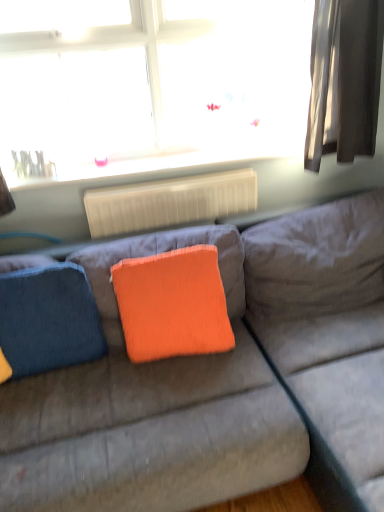
Question: Should I look upward or downward to see white plastic radiator at center?

Choices:
 (A) up
 (B) down

Answer: (A)

Question: Is the surface of orange fabric pillow at center in direct contact with velvet orange pillow at center?

Choices:
 (A) yes
 (B) no

Answer: (B)

Question: Does orange fabric pillow at center have a lesser height compared to velvet orange pillow at center?

Choices:
 (A) yes
 (B) no

Answer: (A)

Question: Would you say orange fabric pillow at center is a long distance from velvet orange pillow at center?

Choices:
 (A) no
 (B) yes

Answer: (A)

Question: Can you confirm if orange fabric pillow at center is smaller than velvet orange pillow at center?

Choices:
 (A) yes
 (B) no

Answer: (A)

Question: Can you confirm if orange fabric pillow at center is thinner than velvet orange pillow at center?

Choices:
 (A) yes
 (B) no

Answer: (A)

Question: Does orange fabric pillow at center have a greater width compared to velvet orange pillow at center?

Choices:
 (A) yes
 (B) no

Answer: (B)

Question: From the image's perspective, would you say silky gray curtain at right is shown under transparent glass window at upper center?

Choices:
 (A) no
 (B) yes

Answer: (B)

Question: Considering the relative sizes of silky gray curtain at right and transparent glass window at upper center in the image provided, is silky gray curtain at right thinner than transparent glass window at upper center?

Choices:
 (A) yes
 (B) no

Answer: (B)

Question: Can you confirm if silky gray curtain at right is positioned to the left of transparent glass window at upper center?

Choices:
 (A) no
 (B) yes

Answer: (A)

Question: Is silky gray curtain at right oriented towards transparent glass window at upper center?

Choices:
 (A) yes
 (B) no

Answer: (B)

Question: From the image's perspective, does silky gray curtain at right appear higher than transparent glass window at upper center?

Choices:
 (A) yes
 (B) no

Answer: (B)

Question: From a real-world perspective, is silky gray curtain at right on transparent glass window at upper center?

Choices:
 (A) yes
 (B) no

Answer: (B)

Question: Is denim cushion at left not near white glossy radiator at upper center?

Choices:
 (A) yes
 (B) no

Answer: (B)